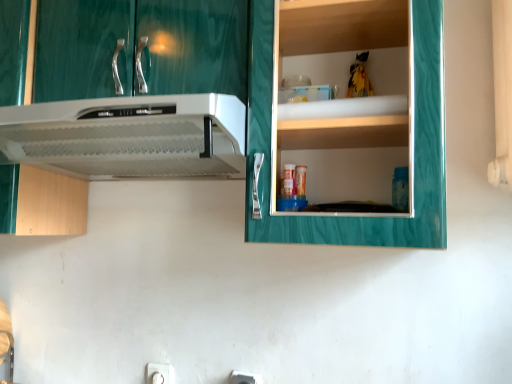
What do you see at coordinates (159, 374) in the screenshot? Image resolution: width=512 pixels, height=384 pixels. I see `white plastic electric outlet at lower center, the 1th electric outlet viewed from the left` at bounding box center [159, 374].

In order to face white plastic electric outlet at lower center, the 1th electric outlet from the right, should I rotate leftwards or rightwards?

You should look left and rotate roughly 1.303 degrees.

Locate an element on the screen. This screenshot has width=512, height=384. white plastic range hood at upper left is located at coordinates [129, 136].

Does point (237, 371) appear closer or farther from the camera than point (167, 375)?

Point (237, 371) is closer to the camera than point (167, 375).

Would you say white plastic electric outlet at lower center, marked as the first electric outlet in a front-to-back arrangement, is inside or outside white plastic electric outlet at lower center, which ranks as the 2th electric outlet in right-to-left order?

white plastic electric outlet at lower center, marked as the first electric outlet in a front-to-back arrangement, exists outside the volume of white plastic electric outlet at lower center, which ranks as the 2th electric outlet in right-to-left order.

Would you say white plastic electric outlet at lower center, the second electric outlet in the left-to-right sequence, is a long distance from white plastic electric outlet at lower center, the 1th electric outlet viewed from the left?

Actually, white plastic electric outlet at lower center, the second electric outlet in the left-to-right sequence, and white plastic electric outlet at lower center, the 1th electric outlet viewed from the left, are a little close together.

Which is in front, white plastic electric outlet at lower center, arranged as the 2th electric outlet when viewed from the back, or white plastic electric outlet at lower center, placed as the 2th electric outlet when sorted from front to back?

white plastic electric outlet at lower center, arranged as the 2th electric outlet when viewed from the back, is closer to the camera.

Which is in front, point (180, 163) or point (247, 373)?

Point (180, 163)

Based on their sizes in the image, would you say white plastic range hood at upper left is bigger or smaller than white plastic electric outlet at lower center, the 1th electric outlet from the right?

In the image, white plastic range hood at upper left appears to be larger than white plastic electric outlet at lower center, the 1th electric outlet from the right.

Is white plastic range hood at upper left further to the viewer compared to white plastic electric outlet at lower center, arranged as the 2th electric outlet when viewed from the back?

No, it is in front of white plastic electric outlet at lower center, arranged as the 2th electric outlet when viewed from the back.

Considering the relative sizes of green marble cabinet at upper right and white plastic electric outlet at lower center, the second electric outlet in the left-to-right sequence, in the image provided, is green marble cabinet at upper right wider than white plastic electric outlet at lower center, the second electric outlet in the left-to-right sequence,?

Yes, green marble cabinet at upper right is wider than white plastic electric outlet at lower center, the second electric outlet in the left-to-right sequence.

Is green marble cabinet at upper right to the left of white plastic electric outlet at lower center, arranged as the 2th electric outlet when viewed from the back, from the viewer's perspective?

Correct, you'll find green marble cabinet at upper right to the left of white plastic electric outlet at lower center, arranged as the 2th electric outlet when viewed from the back.

Is green marble cabinet at upper right in front of or behind white plastic electric outlet at lower center, arranged as the 2th electric outlet when viewed from the back, in the image?

In the image, green marble cabinet at upper right appears in front of white plastic electric outlet at lower center, arranged as the 2th electric outlet when viewed from the back.

From the image's perspective, is green marble cabinet at upper right on white plastic electric outlet at lower center, arranged as the 2th electric outlet when viewed from the back?

Yes, from the image's perspective, green marble cabinet at upper right is over white plastic electric outlet at lower center, arranged as the 2th electric outlet when viewed from the back.

Can you confirm if white plastic electric outlet at lower center, the first electric outlet in the back-to-front sequence, is wider than green marble cabinet at upper right?

Incorrect, the width of white plastic electric outlet at lower center, the first electric outlet in the back-to-front sequence, does not surpass that of green marble cabinet at upper right.

Is white plastic electric outlet at lower center, the first electric outlet in the back-to-front sequence, turned away from green marble cabinet at upper right?

No, white plastic electric outlet at lower center, the first electric outlet in the back-to-front sequence, is not facing the opposite direction of green marble cabinet at upper right.

From a real-world perspective, is white plastic electric outlet at lower center, placed as the 2th electric outlet when sorted from front to back, located beneath green marble cabinet at upper right?

Yes.

Locate an element on the screen. Image resolution: width=512 pixels, height=384 pixels. electric outlet that is the 2nd one when counting downward from the green marble cabinet at upper right (from the image's perspective) is located at coordinates (159, 374).

From a real-world perspective, is white plastic electric outlet at lower center, placed as the 2th electric outlet when sorted from front to back, beneath white plastic range hood at upper left?

Yes.

Does white plastic electric outlet at lower center, which ranks as the 2th electric outlet in right-to-left order, have a smaller size compared to white plastic range hood at upper left?

Correct, white plastic electric outlet at lower center, which ranks as the 2th electric outlet in right-to-left order, occupies less space than white plastic range hood at upper left.

Between white plastic electric outlet at lower center, placed as the 2th electric outlet when sorted from front to back, and white plastic range hood at upper left, which one has larger width?

With larger width is white plastic range hood at upper left.

The height and width of the screenshot is (384, 512). I want to click on the 2nd electric outlet behind the white plastic range hood at upper left, starting your count from the anchor, so click(x=159, y=374).

Which point is more distant from viewer, (234, 377) or (166, 109)?

The point (234, 377) is behind.

Are white plastic electric outlet at lower center, the second electric outlet in the left-to-right sequence, and white plastic range hood at upper left beside each other?

No, white plastic electric outlet at lower center, the second electric outlet in the left-to-right sequence, is not making contact with white plastic range hood at upper left.

Would you say white plastic electric outlet at lower center, the second electric outlet in the left-to-right sequence, is to the left or to the right of white plastic range hood at upper left in the picture?

From the image, it's evident that white plastic electric outlet at lower center, the second electric outlet in the left-to-right sequence, is to the right of white plastic range hood at upper left.

From a real-world perspective, who is located lower, white plastic electric outlet at lower center, marked as the first electric outlet in a front-to-back arrangement, or white plastic range hood at upper left?

white plastic electric outlet at lower center, marked as the first electric outlet in a front-to-back arrangement, is physically lower.

From the image's perspective, which is below, green marble cabinet at upper right or white plastic electric outlet at lower center, which ranks as the 2th electric outlet in right-to-left order?

white plastic electric outlet at lower center, which ranks as the 2th electric outlet in right-to-left order, from the image's perspective.

Is green marble cabinet at upper right taller than white plastic electric outlet at lower center, which ranks as the 2th electric outlet in right-to-left order?

Correct, green marble cabinet at upper right is much taller as white plastic electric outlet at lower center, which ranks as the 2th electric outlet in right-to-left order.

Does green marble cabinet at upper right contain white plastic electric outlet at lower center, placed as the 2th electric outlet when sorted from front to back?

No.

What's the angular difference between green marble cabinet at upper right and white plastic electric outlet at lower center, placed as the 2th electric outlet when sorted from front to back,'s facing directions?

1.57 degrees separate the facing orientations of green marble cabinet at upper right and white plastic electric outlet at lower center, placed as the 2th electric outlet when sorted from front to back.

This screenshot has width=512, height=384. In order to click on electric outlet behind the white plastic electric outlet at lower center, the second electric outlet in the left-to-right sequence in this screenshot , I will do `click(159, 374)`.

At what (x,y) coordinates should I click in order to perform the action: click on home appliance positioned vertically above the white plastic electric outlet at lower center, arranged as the 2th electric outlet when viewed from the back (from a real-world perspective). Please return your answer as a coordinate pair (x, y). This screenshot has height=384, width=512. Looking at the image, I should click on (129, 136).

Considering their positions, is green marble cabinet at upper right positioned further to white plastic electric outlet at lower center, the second electric outlet in the left-to-right sequence, than white plastic range hood at upper left?

white plastic range hood at upper left lies further to white plastic electric outlet at lower center, the second electric outlet in the left-to-right sequence, than the other object.

Considering their positions, is white plastic electric outlet at lower center, placed as the 2th electric outlet when sorted from front to back, positioned closer to white plastic electric outlet at lower center, the second electric outlet in the left-to-right sequence, than green marble cabinet at upper right?

Based on the image, white plastic electric outlet at lower center, placed as the 2th electric outlet when sorted from front to back, appears to be nearer to white plastic electric outlet at lower center, the second electric outlet in the left-to-right sequence.

From the image, which object appears to be nearer to green marble cabinet at upper right, white plastic range hood at upper left or white plastic electric outlet at lower center, the 1th electric outlet viewed from the left?

The object closer to green marble cabinet at upper right is white plastic range hood at upper left.

Which object lies further to the anchor point white plastic range hood at upper left, green marble cabinet at upper right or white plastic electric outlet at lower center, arranged as the 2th electric outlet when viewed from the back?

white plastic electric outlet at lower center, arranged as the 2th electric outlet when viewed from the back, is further to white plastic range hood at upper left.

From the image, which object appears to be nearer to white plastic range hood at upper left, green marble cabinet at upper right or white plastic electric outlet at lower center, the 1th electric outlet viewed from the left?

The object closer to white plastic range hood at upper left is green marble cabinet at upper right.

Based on their spatial positions, is white plastic range hood at upper left or white plastic electric outlet at lower center, placed as the 2th electric outlet when sorted from front to back, closer to white plastic electric outlet at lower center, arranged as the 2th electric outlet when viewed from the back?

white plastic electric outlet at lower center, placed as the 2th electric outlet when sorted from front to back, lies closer to white plastic electric outlet at lower center, arranged as the 2th electric outlet when viewed from the back, than the other object.

From the image, which object appears to be nearer to white plastic electric outlet at lower center, placed as the 2th electric outlet when sorted from front to back, white plastic range hood at upper left or white plastic electric outlet at lower center, the 1th electric outlet from the right?

white plastic electric outlet at lower center, the 1th electric outlet from the right, is positioned closer to the anchor white plastic electric outlet at lower center, placed as the 2th electric outlet when sorted from front to back.

Considering their positions, is green marble cabinet at upper right positioned closer to white plastic electric outlet at lower center, the 1th electric outlet from the right, than white plastic electric outlet at lower center, placed as the 2th electric outlet when sorted from front to back?

white plastic electric outlet at lower center, placed as the 2th electric outlet when sorted from front to back, lies closer to white plastic electric outlet at lower center, the 1th electric outlet from the right, than the other object.

Where is `electric outlet between green marble cabinet at upper right and white plastic electric outlet at lower center, the 1th electric outlet viewed from the left, in the vertical direction`? electric outlet between green marble cabinet at upper right and white plastic electric outlet at lower center, the 1th electric outlet viewed from the left, in the vertical direction is located at coordinates (244, 378).

Locate an element on the screen. Image resolution: width=512 pixels, height=384 pixels. home appliance between green marble cabinet at upper right and white plastic electric outlet at lower center, the 1th electric outlet viewed from the left, from top to bottom is located at coordinates (129, 136).

The width and height of the screenshot is (512, 384). In order to click on home appliance between green marble cabinet at upper right and white plastic electric outlet at lower center, arranged as the 2th electric outlet when viewed from the back, from top to bottom in this screenshot , I will do `click(129, 136)`.

Identify the location of electric outlet between white plastic range hood at upper left and white plastic electric outlet at lower center, the first electric outlet in the back-to-front sequence, in the up-down direction. This screenshot has width=512, height=384. (244, 378).